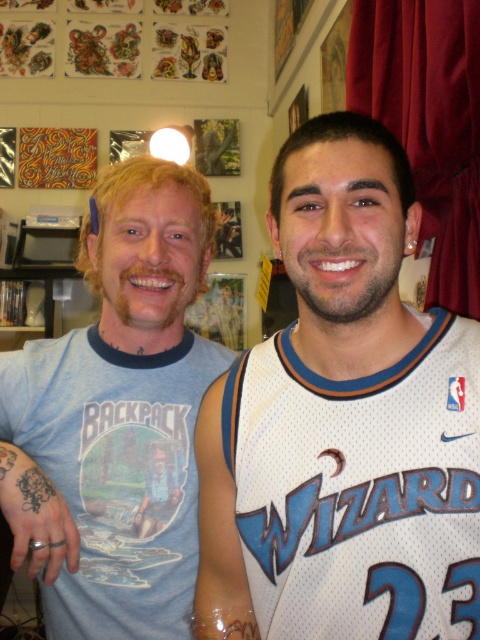
Question: Among these points, which one is farthest from the camera?

Choices:
 (A) (243, 570)
 (B) (379, 179)

Answer: (A)

Question: Which object is the farthest from the white jersey at center?

Choices:
 (A) light blue cotton t-shirt at left
 (B) clear plastic bandage at upper right
 (C) blue t-shirt at left

Answer: (A)

Question: Is white jersey at center smaller than blue t-shirt at left?

Choices:
 (A) yes
 (B) no

Answer: (A)

Question: Does white jersey at center have a greater width compared to light blue cotton t-shirt at left?

Choices:
 (A) yes
 (B) no

Answer: (A)

Question: Can you confirm if white jersey at center is positioned below light blue cotton t-shirt at left?

Choices:
 (A) yes
 (B) no

Answer: (B)

Question: Which object is closer to the camera taking this photo?

Choices:
 (A) blue t-shirt at left
 (B) light blue cotton t-shirt at left
 (C) white jersey at center
 (D) clear plastic bandage at upper right

Answer: (C)